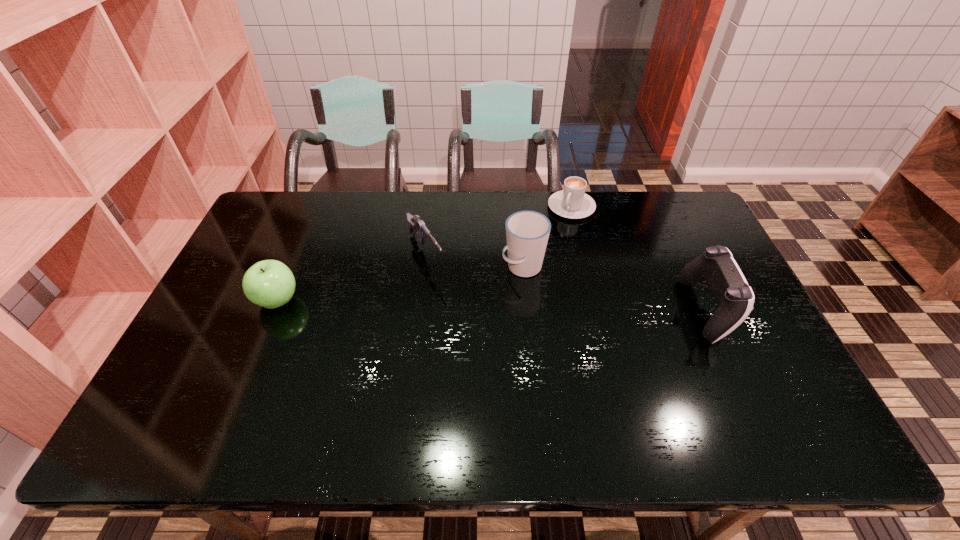
Locate an element on the screen. The height and width of the screenshot is (540, 960). free spot located 0.220m to the right of the shortest object is located at coordinates (539, 259).

Identify the location of vacant space located 0.100m to the right of the shortest object. (552, 237).

The image size is (960, 540). I want to click on blank space located to the right of the shortest object, so click(549, 242).

At what (x,y) coordinates should I click in order to perform the action: click on free space located with a handle on the side of the cup. Please return your answer as a coordinate pair (x, y). Image resolution: width=960 pixels, height=540 pixels. Looking at the image, I should click on (442, 318).

You are a GUI agent. You are given a task and a screenshot of the screen. Output one action in this format:
    pyautogui.click(x=<x>, y=<y>)
    Task: Click on the blank area located 0.300m with a handle on the side of the cup
    The height and width of the screenshot is (540, 960).
    Given the screenshot: What is the action you would take?
    pyautogui.click(x=423, y=329)

I want to click on free spot located 0.260m with a handle on the side of the cup, so click(x=436, y=321).

This screenshot has width=960, height=540. In order to click on gun at the far edge in this screenshot , I will do `click(417, 227)`.

Find the location of a particular element. Image resolution: width=960 pixels, height=540 pixels. cappuccino that is at the far edge is located at coordinates (572, 202).

This screenshot has width=960, height=540. In order to click on object situated at the left edge in this screenshot , I will do `click(270, 284)`.

Locate an element on the screen. The width and height of the screenshot is (960, 540). object that is positioned at the right edge is located at coordinates (734, 297).